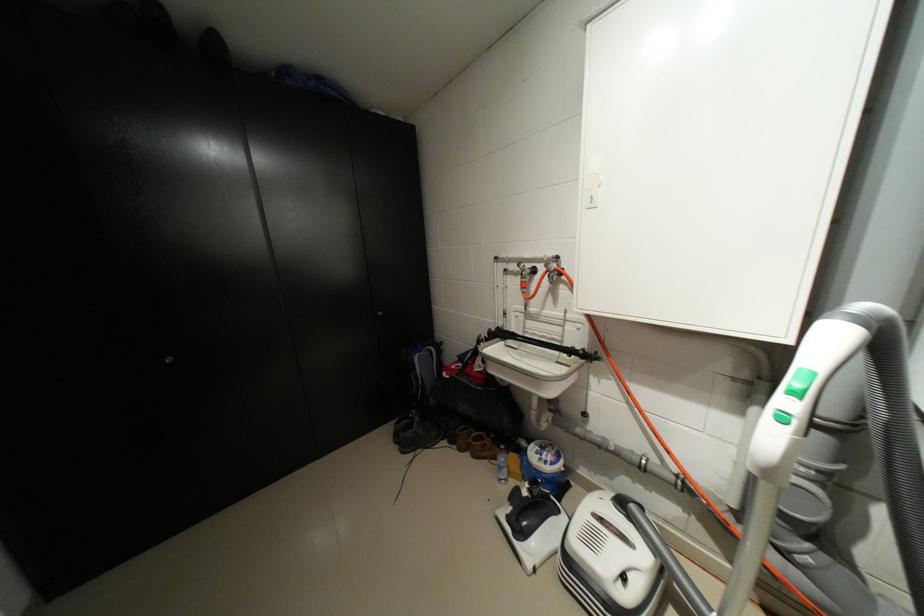
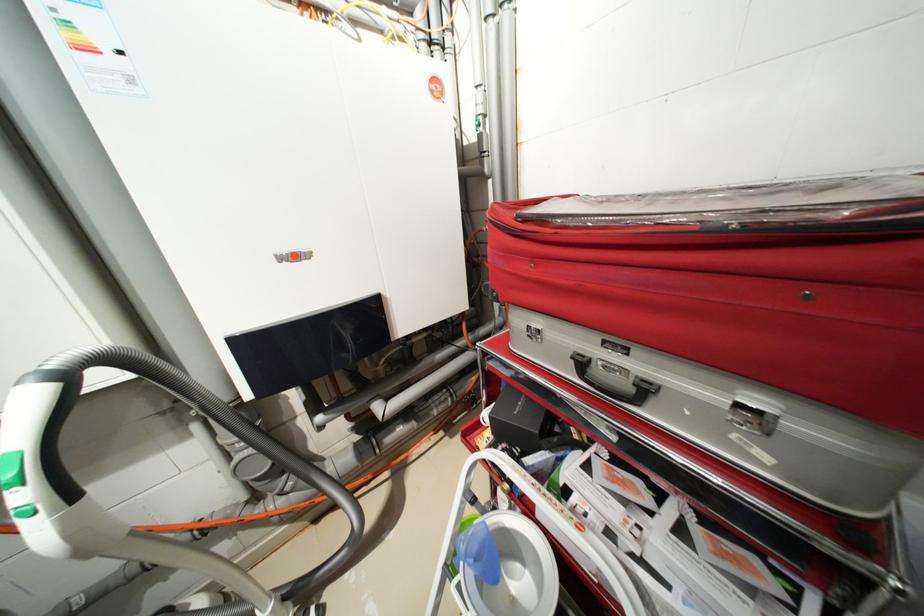
The first image is from the beginning of the video and the second image is from the end. How did the camera likely rotate when shooting the video?

The camera's rotation is toward right-down.